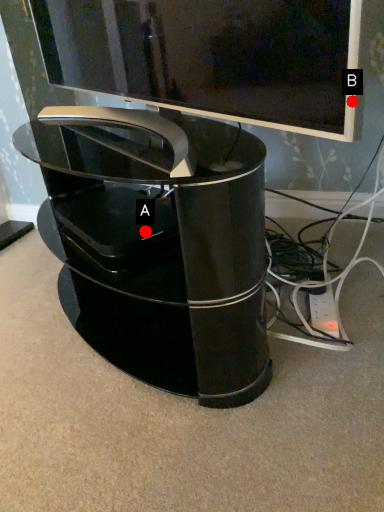
Question: Two points are circled on the image, labeled by A and B beside each circle. Which point is closer to the camera?

Choices:
 (A) A is closer
 (B) B is closer

Answer: (B)